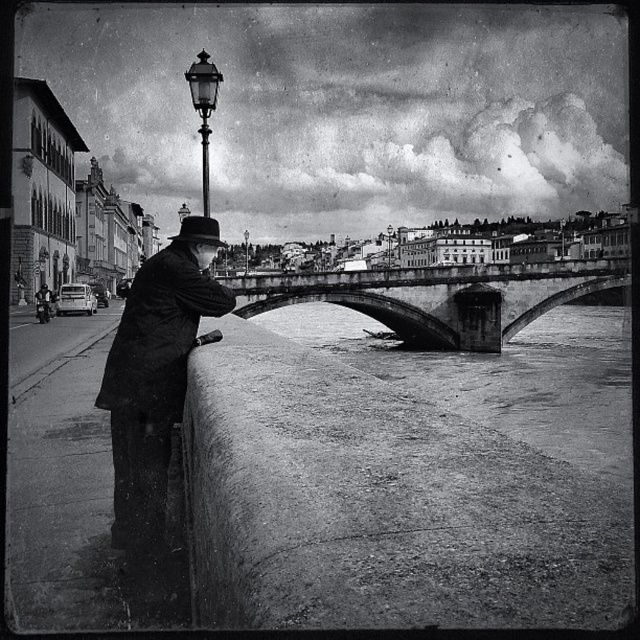
You are standing in the scene and want to move from the dark matte coat at left to the polished brass streetlamp at upper center. Which direction should you move to reach it?

To reach the polished brass streetlamp at upper center from the dark matte coat at left, you should move to the left since the dark matte coat at left is to the right of the polished brass streetlamp at upper center.

You are an urban planner assessing the width of structures in the scene. Given that the polished brass streetlamp at upper center is 1 meter wide, can you determine if the concrete stone bridge at center is wider than 1 meter?

The concrete stone bridge at center is wider than the polished brass streetlamp at upper center, which is 1 meter wide. Therefore, the concrete stone bridge at center is wider than 1 meter.

Based on the scene described, which object occupies more space in the image? Please consider both the rough concrete river at center and the concrete stone bridge at center in your answer.

The rough concrete river at center has a larger size compared to the concrete stone bridge at center, so the rough concrete river at center occupies more space in the image.